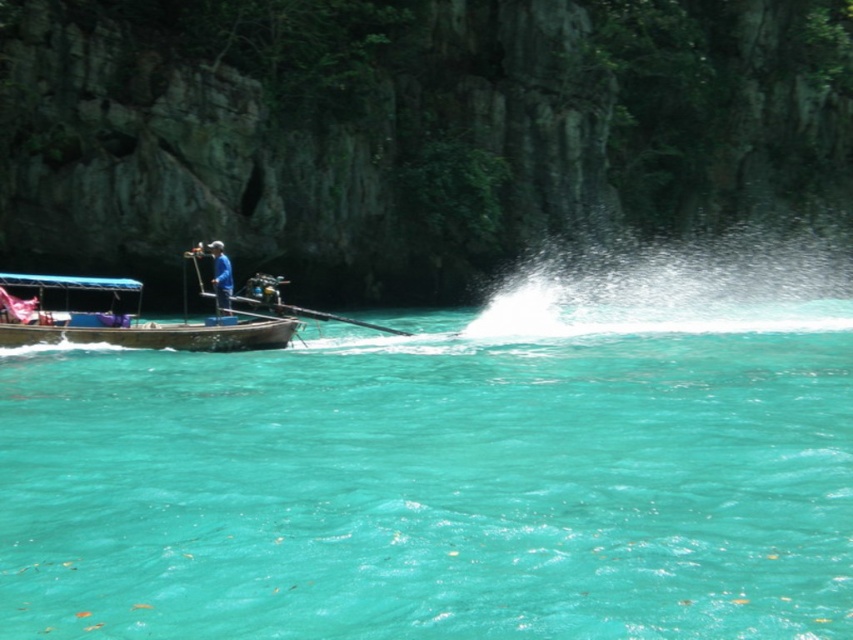
Question: Can you confirm if turquoise clear water at lower left is bigger than brown wooden boat at left?

Choices:
 (A) yes
 (B) no

Answer: (A)

Question: Which object is the farthest from the turquoise clear water at lower left?

Choices:
 (A) blue fabric boat at left
 (B) brown wooden boat at left

Answer: (A)

Question: Is turquoise clear water at lower left positioned at the back of blue fabric boat at left?

Choices:
 (A) yes
 (B) no

Answer: (B)

Question: Which of the following is the farthest from the observer?

Choices:
 (A) brown wooden boat at left
 (B) blue fabric boat at left

Answer: (B)

Question: Can you confirm if turquoise clear water at lower left is wider than brown wooden boat at left?

Choices:
 (A) no
 (B) yes

Answer: (B)

Question: Which point is closer to the camera taking this photo?

Choices:
 (A) (224, 291)
 (B) (84, 289)
 (C) (813, 563)

Answer: (C)